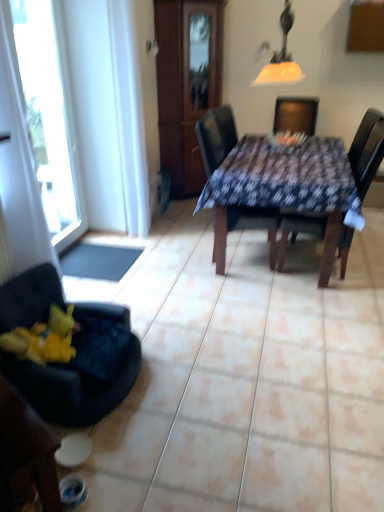
You are a GUI agent. You are given a task and a screenshot of the screen. Output one action in this format:
    pyautogui.click(x=<x>, y=<y>)
    Task: Click on the free space above black rubber mat at lower left (from a real-world perspective)
    This screenshot has height=512, width=384.
    Given the screenshot: What is the action you would take?
    click(105, 251)